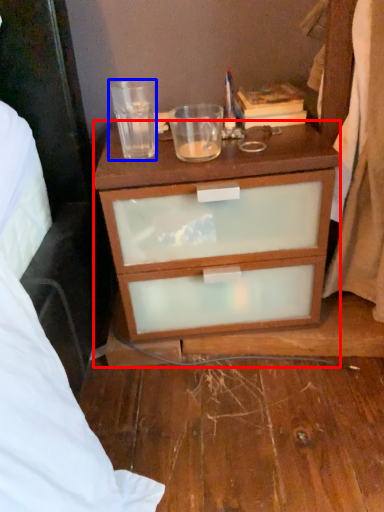
Question: Among these objects, which one is nearest to the camera, desk (highlighted by a red box) or coffee cup (highlighted by a blue box)?

Choices:
 (A) desk
 (B) coffee cup

Answer: (A)